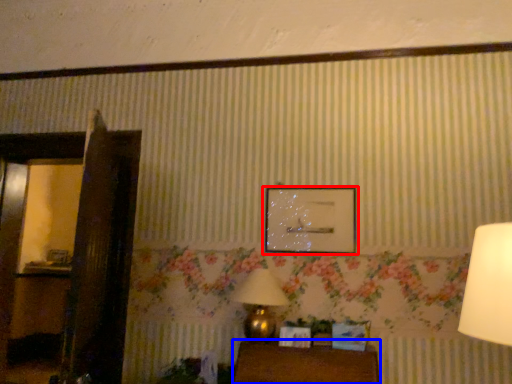
Question: Among these objects, which one is nearest to the camera, picture frame (highlighted by a red box) or furniture (highlighted by a blue box)?

Choices:
 (A) picture frame
 (B) furniture

Answer: (B)